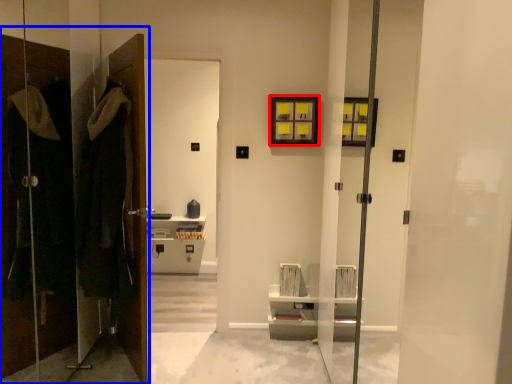
Question: Which object appears closest to the camera in this image, picture frame (highlighted by a red box) or closet (highlighted by a blue box)?

Choices:
 (A) picture frame
 (B) closet

Answer: (B)